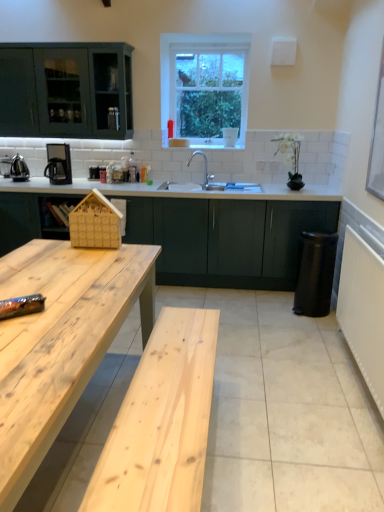
Describe the element at coordinates (95, 223) in the screenshot. I see `wooden house at center` at that location.

Identify the location of wooden house at center. The image size is (384, 512). (95, 223).

What are the coordinates of `clear glass window at upper center` in the screenshot? It's located at (205, 85).

In order to face matte black coffee machine at left, should I rotate leftwards or rightwards?

Rotate left and turn 17.007 degrees.

Measure the distance between polished stainless steel kettle at left and camera.

polished stainless steel kettle at left and camera are 4.05 meters apart from each other.

Where is `wooden house at center`? The image size is (384, 512). wooden house at center is located at coordinates (95, 223).

How different are the orientations of matte black coffee machine at left and white ceramic sink at center in degrees?

There is a 0.756-degree angle between the facing directions of matte black coffee machine at left and white ceramic sink at center.

From a real-world perspective, is matte black coffee machine at left physically below white ceramic sink at center?

No, from a real-world perspective, matte black coffee machine at left is not under white ceramic sink at center.

Locate an element on the screen. Image resolution: width=384 pixels, height=512 pixels. sink below the matte black coffee machine at left (from a real-world perspective) is located at coordinates (202, 175).

Considering the sizes of objects matte black coffee machine at left and white ceramic sink at center in the image provided, who is smaller, matte black coffee machine at left or white ceramic sink at center?

matte black coffee machine at left.

Considering the sizes of objects dark green matte cabinet at center and white textured radiator at right in the image provided, who is bigger, dark green matte cabinet at center or white textured radiator at right?

Bigger between the two is dark green matte cabinet at center.

From a real-world perspective, is dark green matte cabinet at center below white textured radiator at right?

Yes, from a real-world perspective, dark green matte cabinet at center is below white textured radiator at right.

Does dark green matte cabinet at center come behind white textured radiator at right?

Yes, it is behind white textured radiator at right.

Based on the photo, does dark green matte cabinet at center appear on the right side of white textured radiator at right?

In fact, dark green matte cabinet at center is to the left of white textured radiator at right.

From a real-world perspective, is wooden house at center located higher than clear glass window at upper center?

Incorrect, from a real-world perspective, wooden house at center is lower than clear glass window at upper center.

Is point (92, 238) closer or farther from the camera than point (219, 118)?

Point (92, 238) appears to be closer to the viewer than point (219, 118).

Who is more distant, wooden house at center or clear glass window at upper center?

clear glass window at upper center is further away from the camera.

Which object is positioned more to the right, white ceramic sink at center or clear glass window at upper center?

white ceramic sink at center.

Is the surface of white ceramic sink at center in direct contact with clear glass window at upper center?

No.

Does white ceramic sink at center have a greater width compared to clear glass window at upper center?

Correct, the width of white ceramic sink at center exceeds that of clear glass window at upper center.

Looking at this image, from the image's perspective, which one is positioned lower, white ceramic sink at center or clear glass window at upper center?

From the image's view, white ceramic sink at center is below.

Considering the sizes of objects white ceramic sink at center and matte black coffee machine at left in the image provided, who is taller, white ceramic sink at center or matte black coffee machine at left?

With more height is matte black coffee machine at left.

Which is more to the right, white ceramic sink at center or matte black coffee machine at left?

white ceramic sink at center.

Does white ceramic sink at center have a smaller size compared to matte black coffee machine at left?

Actually, white ceramic sink at center might be larger than matte black coffee machine at left.

Would you say white ceramic sink at center is outside matte black coffee machine at left?

Yes, white ceramic sink at center is not within matte black coffee machine at left.

Is white ceramic sink at center bigger than polished stainless steel kettle at left?

Indeed, white ceramic sink at center has a larger size compared to polished stainless steel kettle at left.

Is white ceramic sink at center further to camera compared to polished stainless steel kettle at left?

That is False.

From a real-world perspective, which object stands above the other?

In real-world perspective, polished stainless steel kettle at left is above.

Who is taller, white ceramic sink at center or wooden house at center?

wooden house at center is taller.

I want to click on basket below the white ceramic sink at center (from the image's perspective), so click(x=95, y=223).

Could wooden house at center be considered to be inside white ceramic sink at center?

No, white ceramic sink at center does not contain wooden house at center.

Considering the sizes of white ceramic sink at center and wooden house at center in the image, is white ceramic sink at center bigger or smaller than wooden house at center?

In the image, white ceramic sink at center appears to be larger than wooden house at center.

The width and height of the screenshot is (384, 512). Find the location of `coffee machine above the white ceramic sink at center (from the image's perspective)`. coffee machine above the white ceramic sink at center (from the image's perspective) is located at coordinates (58, 164).

The height and width of the screenshot is (512, 384). I want to click on cabinetry behind the white textured radiator at right, so click(x=227, y=238).

Considering their positions, is wooden house at center positioned further to white textured radiator at right than natural wood table at lower left?

The object further to white textured radiator at right is wooden house at center.

Considering their positions, is wooden house at center positioned further to dark green matte cabinet at center than white textured radiator at right?

The object further to dark green matte cabinet at center is wooden house at center.

Considering their positions, is polished stainless steel kettle at left positioned closer to wooden house at center than clear glass window at upper center?

polished stainless steel kettle at left lies closer to wooden house at center than the other object.

Considering their positions, is wooden house at center positioned closer to matte black coffee machine at left than clear glass window at upper center?

clear glass window at upper center.

Consider the image. When comparing their distances from white textured radiator at right, does natural wood table at lower left or clear glass window at upper center seem closer?

Based on the image, natural wood table at lower left appears to be nearer to white textured radiator at right.

Considering their positions, is natural wood table at lower left positioned further to wooden house at center than clear glass window at upper center?

clear glass window at upper center is further to wooden house at center.

Which object lies nearer to the anchor point matte black coffee machine at left, polished stainless steel kettle at left or natural wood table at lower left?

polished stainless steel kettle at left is positioned closer to the anchor matte black coffee machine at left.

Which object lies nearer to the anchor point wooden house at center, white ceramic sink at center or clear glass window at upper center?

The object closer to wooden house at center is white ceramic sink at center.

Find the location of a particular element. Image resolution: width=384 pixels, height=512 pixels. sink situated between matte black coffee machine at left and white textured radiator at right from left to right is located at coordinates (202, 175).

What are the coordinates of `cabinetry positioned between natural wood table at lower left and matte black coffee machine at left from near to far` in the screenshot? It's located at (227, 238).

Where is `basket between polished stainless steel kettle at left and white ceramic sink at center from left to right`? basket between polished stainless steel kettle at left and white ceramic sink at center from left to right is located at coordinates (95, 223).

At what (x,y) coordinates should I click in order to perform the action: click on radiator between natural wood table at lower left and white ceramic sink at center along the z-axis. Please return your answer as a coordinate pair (x, y). This screenshot has height=512, width=384. Looking at the image, I should click on (363, 310).